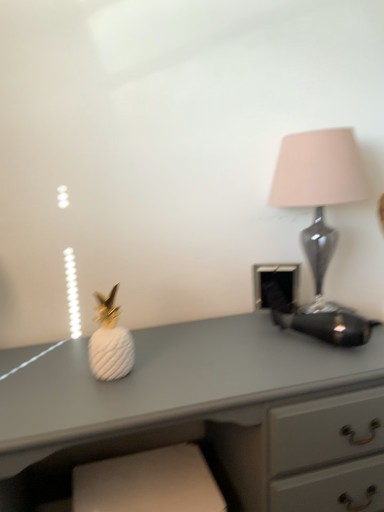
Question: Considering the positions of point (263, 505) and point (125, 351), is point (263, 505) closer or farther from the camera than point (125, 351)?

Choices:
 (A) closer
 (B) farther

Answer: (A)

Question: From a real-world perspective, is white matte pineapple at left above or below white matte pineapple at center?

Choices:
 (A) above
 (B) below

Answer: (B)

Question: Which is farther from the white matte pineapple at left?

Choices:
 (A) white matte pineapple at center
 (B) matte glass lamp at right

Answer: (B)

Question: Estimate the real-world distances between objects in this image. Which object is closer to the white matte pineapple at left?

Choices:
 (A) white matte pineapple at center
 (B) matte glass lamp at right

Answer: (A)